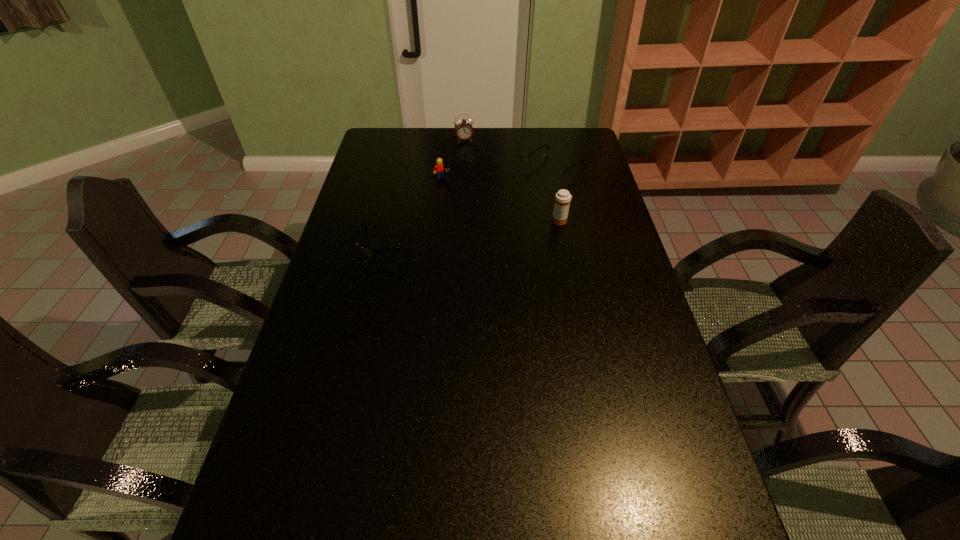
In order to click on object at the left edge in this screenshot , I will do `click(389, 251)`.

At what (x,y) coordinates should I click in order to perform the action: click on medicine located in the right edge section of the desktop. Please return your answer as a coordinate pair (x, y). The width and height of the screenshot is (960, 540). Looking at the image, I should click on (562, 198).

You are a GUI agent. You are given a task and a screenshot of the screen. Output one action in this format:
    pyautogui.click(x=<x>, y=<y>)
    Task: Click on the spectacles present at the right edge
    
    Given the screenshot: What is the action you would take?
    click(551, 174)

Locate an element on the screen. object that is at the far right corner is located at coordinates (551, 174).

The height and width of the screenshot is (540, 960). What are the coordinates of `free space at the far edge` in the screenshot? It's located at (507, 156).

This screenshot has height=540, width=960. In the image, there is a desktop. Find the location of `vacant space at the left edge`. vacant space at the left edge is located at coordinates (396, 167).

In the image, there is a desktop. At what (x,y) coordinates should I click in order to perform the action: click on vacant space at the right edge. Please return your answer as a coordinate pair (x, y). The image size is (960, 540). Looking at the image, I should click on (614, 228).

Identify the location of free spot between the shorter spectacles and the farther spectacles. click(x=468, y=205).

The image size is (960, 540). In order to click on empty space between the alarm clock and the medicine in this screenshot , I will do `click(513, 180)`.

Where is `free spot between the third object from right to left and the right spectacles`? The width and height of the screenshot is (960, 540). free spot between the third object from right to left and the right spectacles is located at coordinates (509, 154).